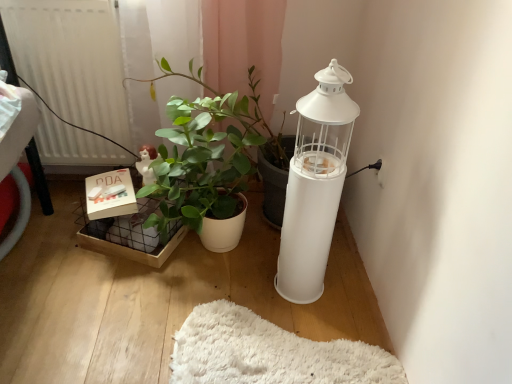
Locate an element on the screen. The width and height of the screenshot is (512, 384). free point above matte white box at lower left (from a real-world perspective) is located at coordinates (109, 182).